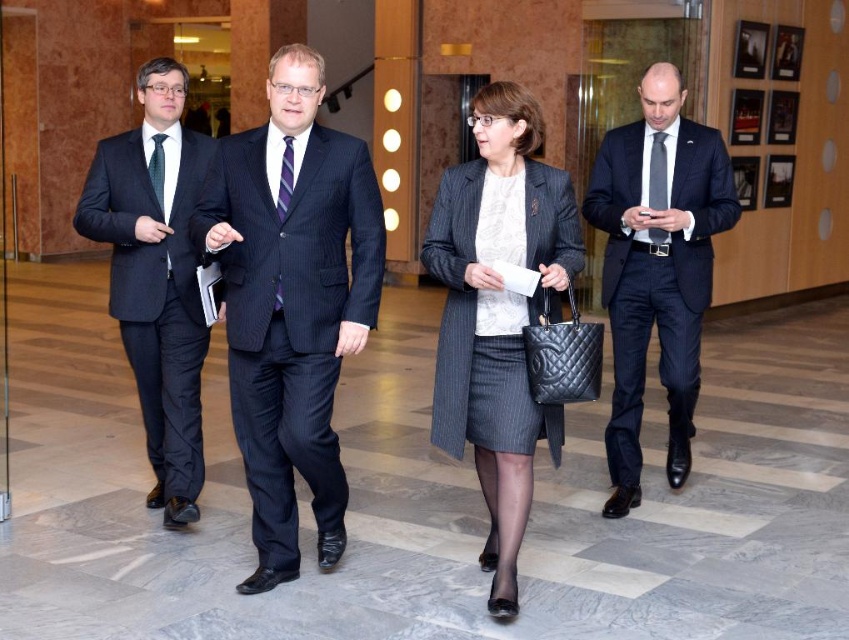
You are a security guard in the building and need to inspect the items carried by the people passing by. The policy states that any item within 3 feet must be checked. Are you required to check the matte gray coat at center or the striped silk tie at center?

The matte gray coat at center is 3.41 feet away from the striped silk tie at center. Since the distance between them is more than 3 feet, the security guard does not need to check either item as they are both outside the 3 feet requirement range.

You are an event planner arranging a photoshoot in the described indoor setting. You need to place two mannequins wearing the pinstriped suit at center and the matte gray coat at center on a mirrored floor. Which mannequin will cast a clearer reflection on the floor?

The pinstriped suit at center will cast a clearer reflection on the floor because it is positioned over the matte gray coat at center, meaning it is closer to the reflective surface.

You are a security guard in the building. You see two people at point (124,205). The minimum distance required between people in this building is 2 meters for safety. Can you confirm if they are following the safety guidelines?

The two people at point (124,205) are 3.73 meters apart, which exceeds the 2 meter requirement. Therefore, they are following the safety guidelines.